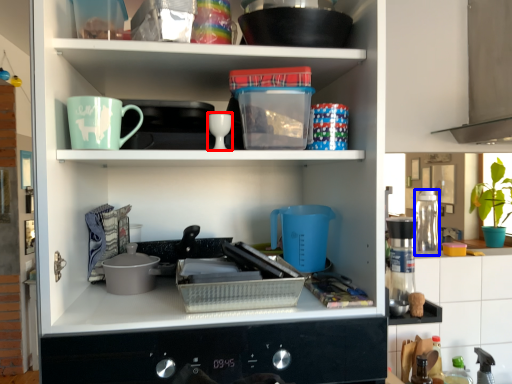
Question: Which of the following is the closest to the observer, tableware (highlighted by a red box) or appliance (highlighted by a blue box)?

Choices:
 (A) tableware
 (B) appliance

Answer: (A)